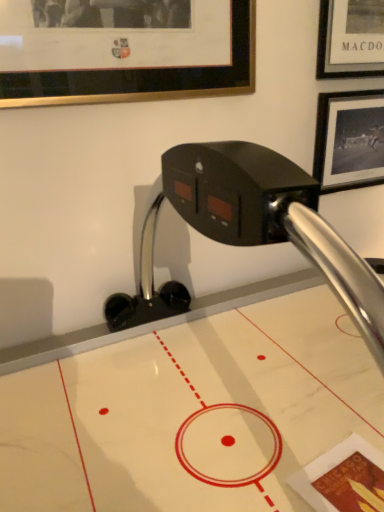
Question: Does point (375, 167) appear closer or farther from the camera than point (236, 458)?

Choices:
 (A) farther
 (B) closer

Answer: (A)

Question: From the image's perspective, is black matte picture frame at upper right, the first picture frame from the back, located above or below white marble air hockey table at center?

Choices:
 (A) above
 (B) below

Answer: (A)

Question: Estimate the real-world distances between objects in this image. Which object is closer to the white marble air hockey table at center?

Choices:
 (A) black matte picture frame at upper right, the 2th picture frame in the left-to-right sequence
 (B) gold-framed picture at upper left, the 1th picture frame from the left

Answer: (A)

Question: Which is farther from the black matte picture frame at upper right, the 2th picture frame viewed from the front?

Choices:
 (A) white marble air hockey table at center
 (B) gold-framed picture at upper left, which is counted as the 1th picture frame, starting from the front

Answer: (A)